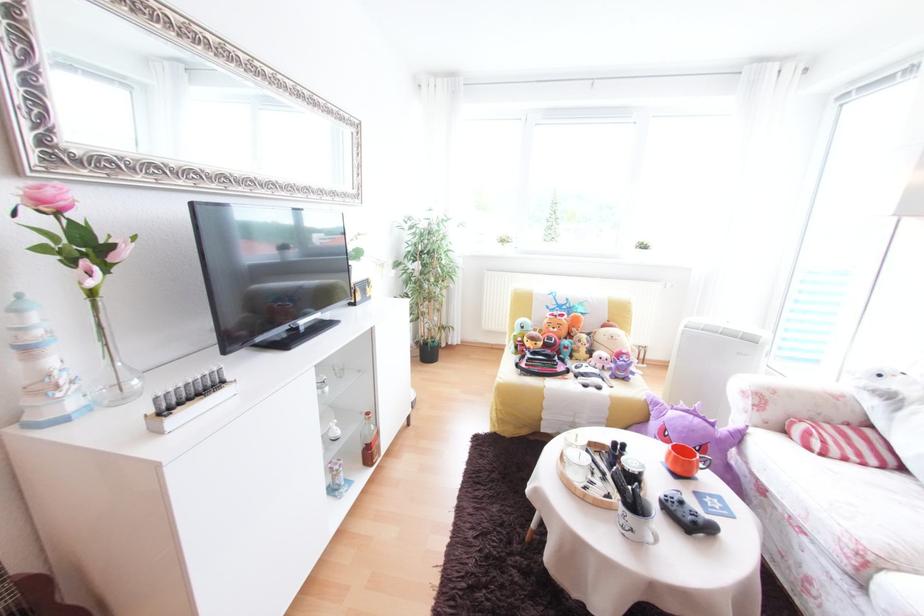
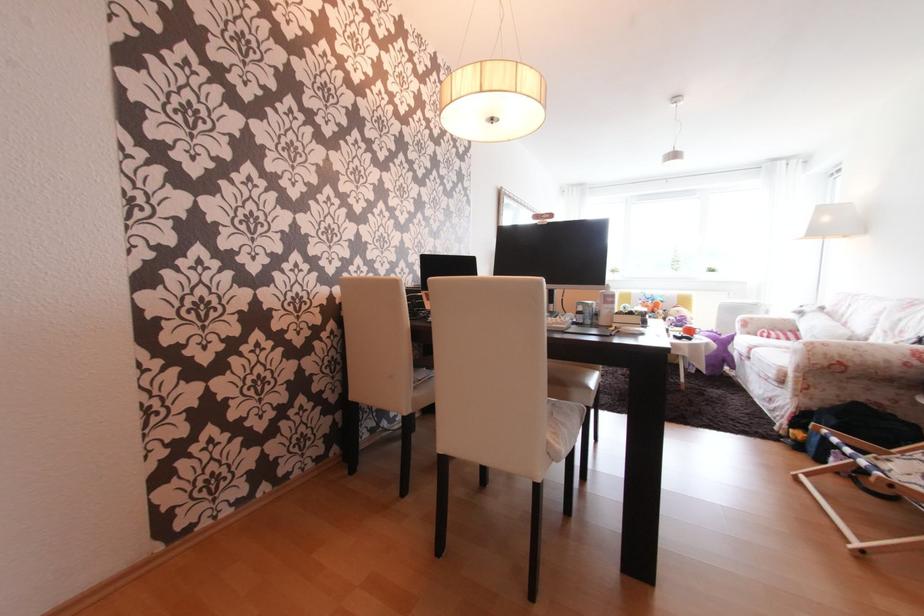
The point at (720, 424) is marked in the first image. Where is the corresponding point in the second image?

(727, 336)